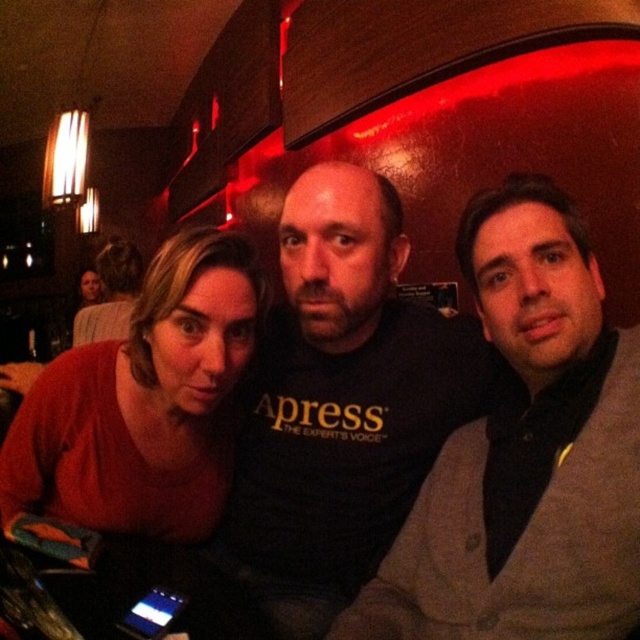
You are standing at a distance of 3 feet from the camera. You want to move forward to the point marked as point (x=474, y=403). Will you be able to reach that point without moving past it?

The distance of point (x=474, y=403) from camera is 3.37 feet. Since you are currently 3 feet away, moving forward would bring you to 3.37 feet, so yes, you can reach the point without moving past it.